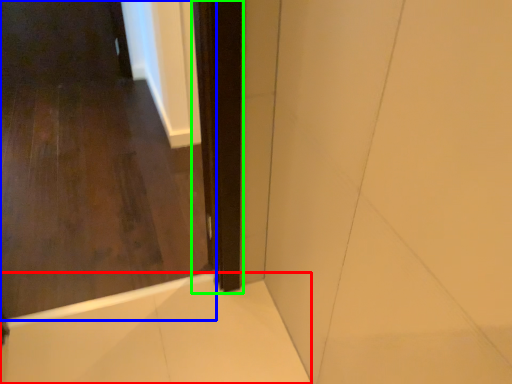
Question: Considering the real-world distances, which object is farthest from bath (highlighted by a red box)? door (highlighted by a blue box) or screen door (highlighted by a green box)?

Choices:
 (A) door
 (B) screen door

Answer: (B)